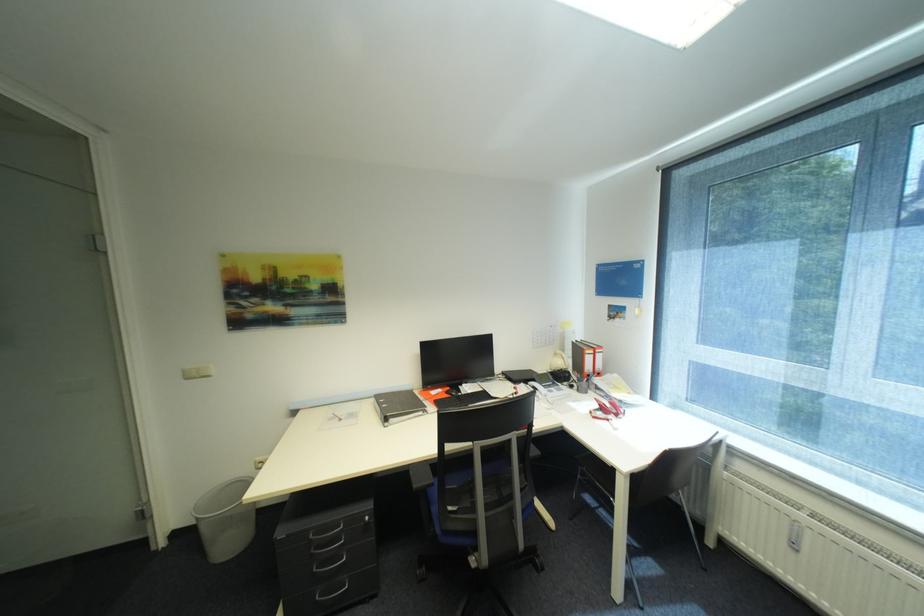
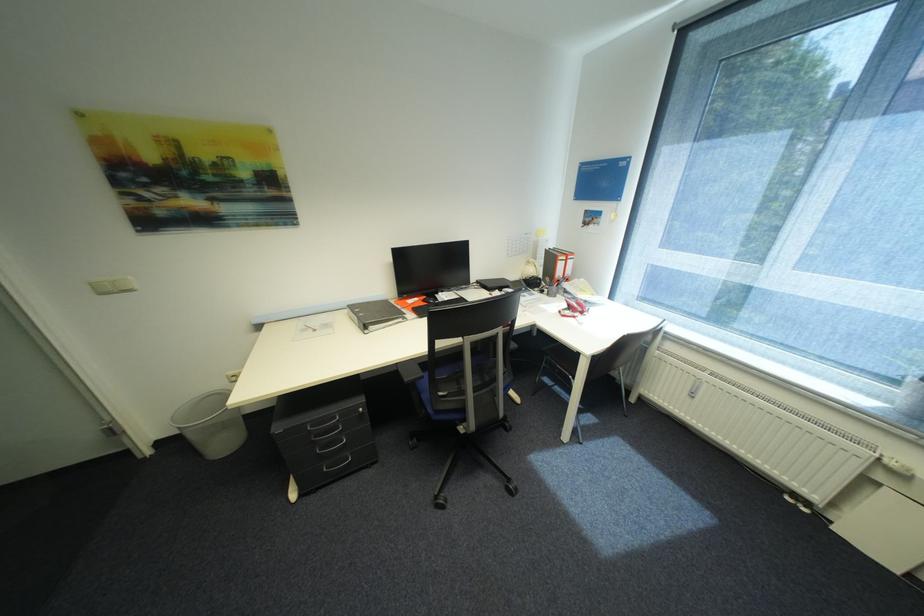
Question: How did the camera likely rotate?

Choices:
 (A) Left
 (B) Right
 (C) Up
 (D) Down

Answer: (D)